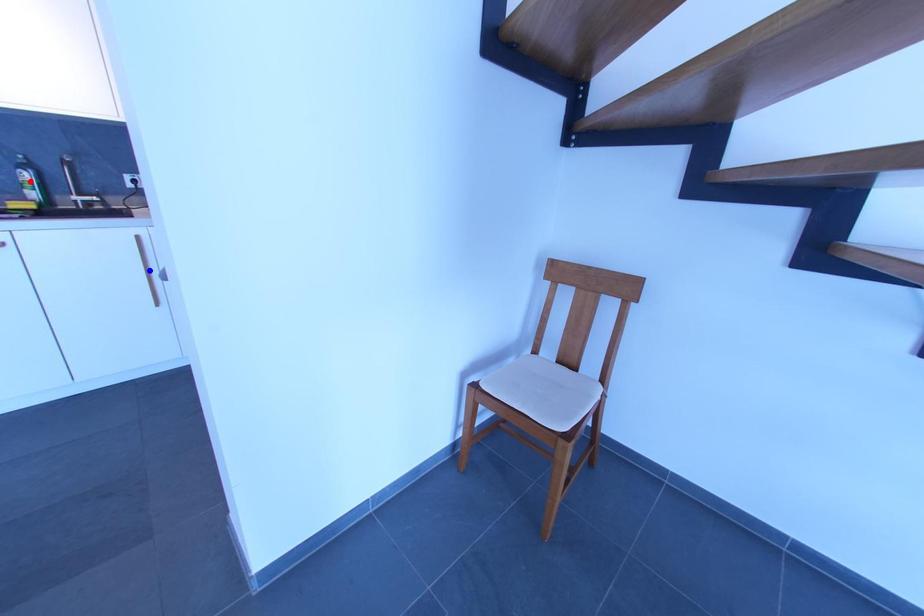
Question: Which of the two points in the image is closer to the camera?

Choices:
 (A) Blue point is closer.
 (B) Red point is closer.

Answer: (B)